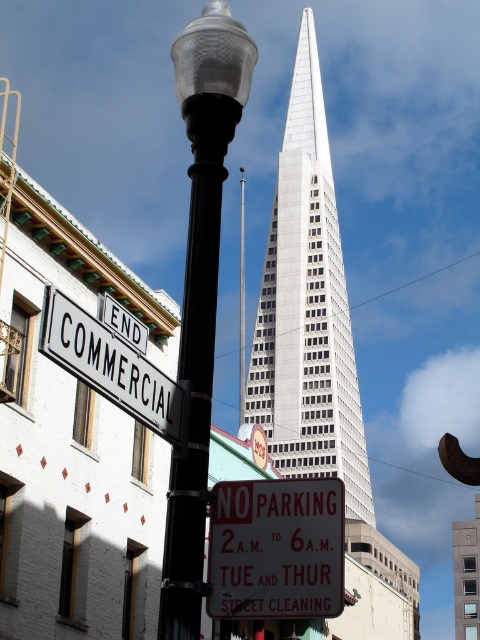
Question: Which of the following is the closest to the observer?

Choices:
 (A) white glass skyscraper at center
 (B) black metal pole at center

Answer: (A)

Question: Which point is closer to the camera taking this photo?

Choices:
 (A) (97, 358)
 (B) (243, 563)
 (C) (320, 260)
 (D) (213, 349)

Answer: (A)

Question: Estimate the real-world distances between objects in this image. Which object is farther from the black metal pole at center?

Choices:
 (A) white glass skyscraper at center
 (B) white plastic sign at center
 (C) matte glass lamp post at center

Answer: (C)

Question: Does white glass skyscraper at center appear on the left side of black metal pole at center?

Choices:
 (A) no
 (B) yes

Answer: (A)

Question: Is white plastic sign at center behind black metal pole at center?

Choices:
 (A) yes
 (B) no

Answer: (B)

Question: Is the position of matte glass lamp post at center more distant than that of black metal pole at center?

Choices:
 (A) no
 (B) yes

Answer: (A)